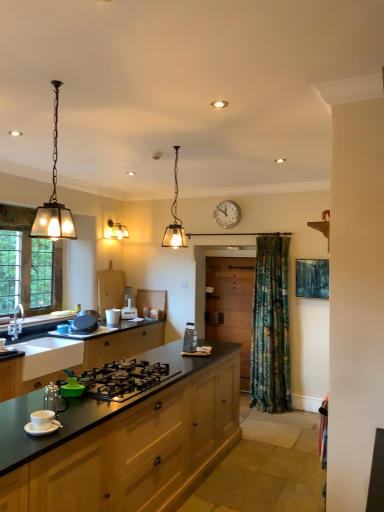
This screenshot has width=384, height=512. Identify the location of vacant space to the right of metallic silver tea pot at lower left. (82, 418).